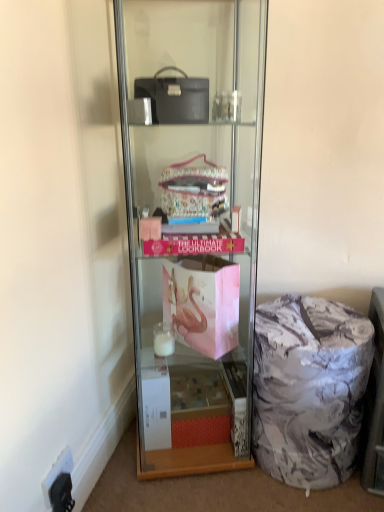
Question: Does clear glass shelf at center come behind black plastic electric outlet at lower left?

Choices:
 (A) no
 (B) yes

Answer: (A)

Question: From the image's perspective, is clear glass shelf at center below black plastic electric outlet at lower left?

Choices:
 (A) yes
 (B) no

Answer: (B)

Question: Does clear glass shelf at center have a smaller size compared to black plastic electric outlet at lower left?

Choices:
 (A) no
 (B) yes

Answer: (A)

Question: Is clear glass shelf at center shorter than black plastic electric outlet at lower left?

Choices:
 (A) no
 (B) yes

Answer: (A)

Question: From a real-world perspective, is clear glass shelf at center located beneath black plastic electric outlet at lower left?

Choices:
 (A) yes
 (B) no

Answer: (B)

Question: Is clear glass shelf at center oriented towards black plastic electric outlet at lower left?

Choices:
 (A) no
 (B) yes

Answer: (A)

Question: Can you confirm if marble-patterned ottoman at lower right is bigger than black plastic electric outlet at lower left?

Choices:
 (A) no
 (B) yes

Answer: (B)

Question: Is marble-patterned ottoman at lower right at the right side of black plastic electric outlet at lower left?

Choices:
 (A) no
 (B) yes

Answer: (B)

Question: Is black plastic electric outlet at lower left at the back of marble-patterned ottoman at lower right?

Choices:
 (A) yes
 (B) no

Answer: (B)

Question: From the image's perspective, does marble-patterned ottoman at lower right appear higher than black plastic electric outlet at lower left?

Choices:
 (A) no
 (B) yes

Answer: (B)

Question: Considering the relative sizes of marble-patterned ottoman at lower right and black plastic electric outlet at lower left in the image provided, is marble-patterned ottoman at lower right taller than black plastic electric outlet at lower left?

Choices:
 (A) yes
 (B) no

Answer: (A)

Question: Is marble-patterned ottoman at lower right thinner than black plastic electric outlet at lower left?

Choices:
 (A) yes
 (B) no

Answer: (B)

Question: Would you say black plastic electric outlet at lower left is a long distance from marble-patterned fabric bag at lower right?

Choices:
 (A) no
 (B) yes

Answer: (A)